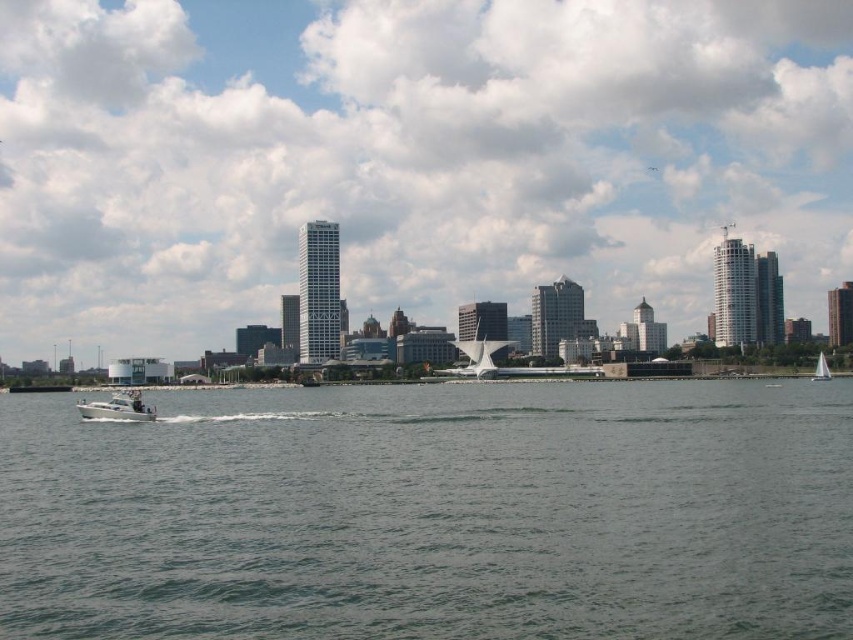
You are standing on a pier and want to estimate how far the white glossy motorboat at lower left is from you. Based on the scene, can you determine the distance?

The white glossy motorboat at lower left is 483.61 feet away from the camera, so you are approximately 483.61 feet away from it.

You are standing at the center of the waterfront area in the middle ground. You want to locate the white glossy motorboat at lower left. In which direction should you look?

You should look towards the lower left direction to locate the white glossy motorboat at lower left, as it is positioned at point coordinates of (119, 406).